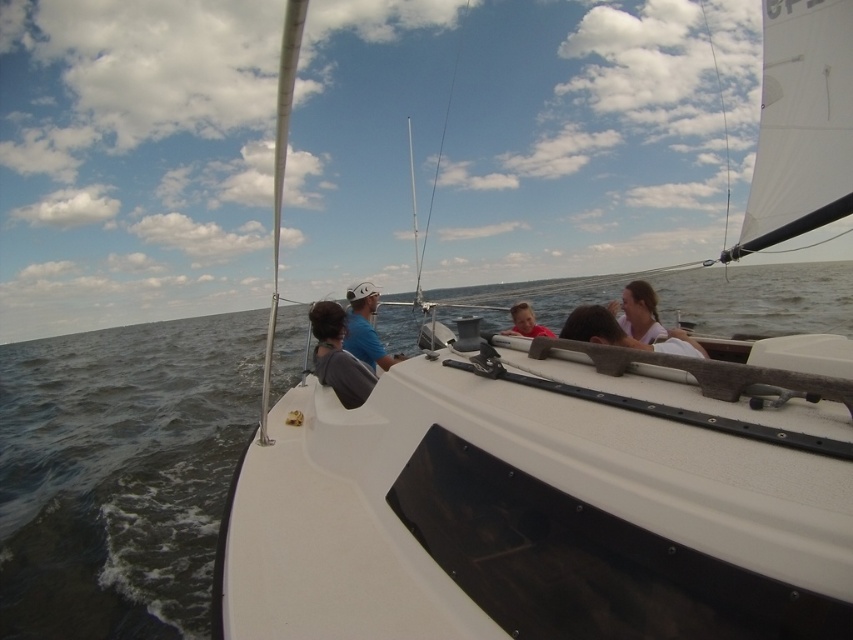
Looking at this image, you are a photographer on the deck of the sailboat. You want to take a photo that includes both the pink fabric hair at upper right and the matte pink shirt at center. The camera you are using has a maximum focus range of 5 feet. Can you capture both subjects in focus without moving the camera?

The pink fabric hair at upper right is 4.99 feet from matte pink shirt at center. Since the distance between them is just under 5 feet, the camera can focus on both subjects within the maximum range of 5 feet, so yes, you can capture both in focus without moving the camera.

You are a photographer on the deck of the sailboat and want to take a photo of the pink fabric at center and the matte blue shirt at center. From your current position, which object is closer to you?

The pink fabric at center is closer to you because it is in front of the matte blue shirt at center.

You are a photographer on the sailboat and want to take a photo of two points on the deck. The first point is at coordinate point (653, 296) and the second is at point (526, 336). If you focus your camera on the point closer to you, which point will be in focus?

Point (653, 296) is closer to the camera than point (526, 336), so if you focus on the closer point, point (653, 296) will be in focus.